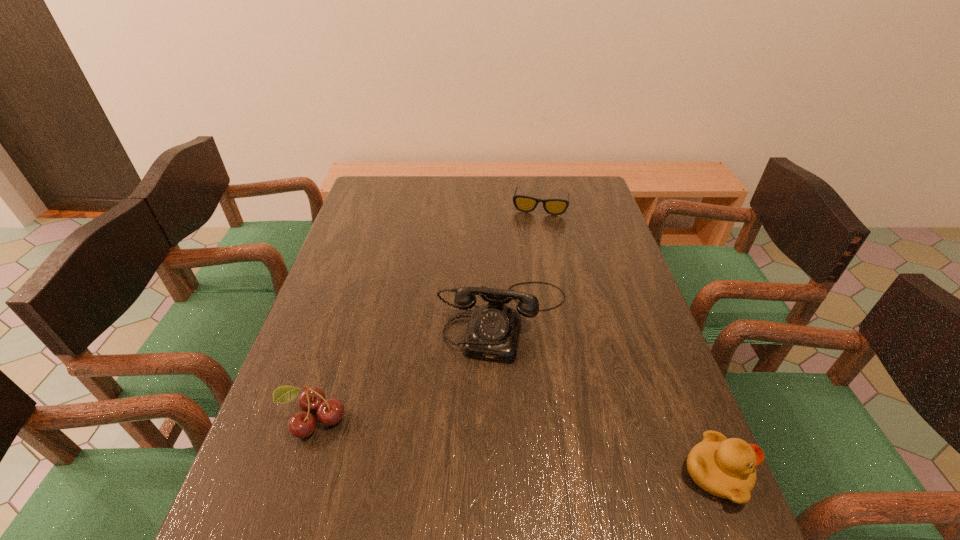
Where is `vacant space located 0.360m on the front-facing side of the shortest object`? This screenshot has height=540, width=960. vacant space located 0.360m on the front-facing side of the shortest object is located at coordinates (525, 285).

Where is `free region located 0.370m on the front-facing side of the shortest object`? The width and height of the screenshot is (960, 540). free region located 0.370m on the front-facing side of the shortest object is located at coordinates (524, 287).

Find the location of a particular element. The width and height of the screenshot is (960, 540). object present at the far edge is located at coordinates (522, 203).

Identify the location of object that is at the near edge. This screenshot has height=540, width=960. (725, 468).

Locate an element on the screen. object that is positioned at the left edge is located at coordinates tap(302, 424).

Identify the location of duckling at the right edge. The image size is (960, 540). (725, 468).

In order to click on sunglasses at the right edge in this screenshot , I will do `click(522, 203)`.

In order to click on object located in the far right corner section of the desktop in this screenshot , I will do `click(522, 203)`.

This screenshot has width=960, height=540. In order to click on object positioned at the near right corner in this screenshot , I will do `click(725, 468)`.

In the image, there is a desktop. In order to click on vacant space at the far edge in this screenshot , I will do click(x=404, y=194).